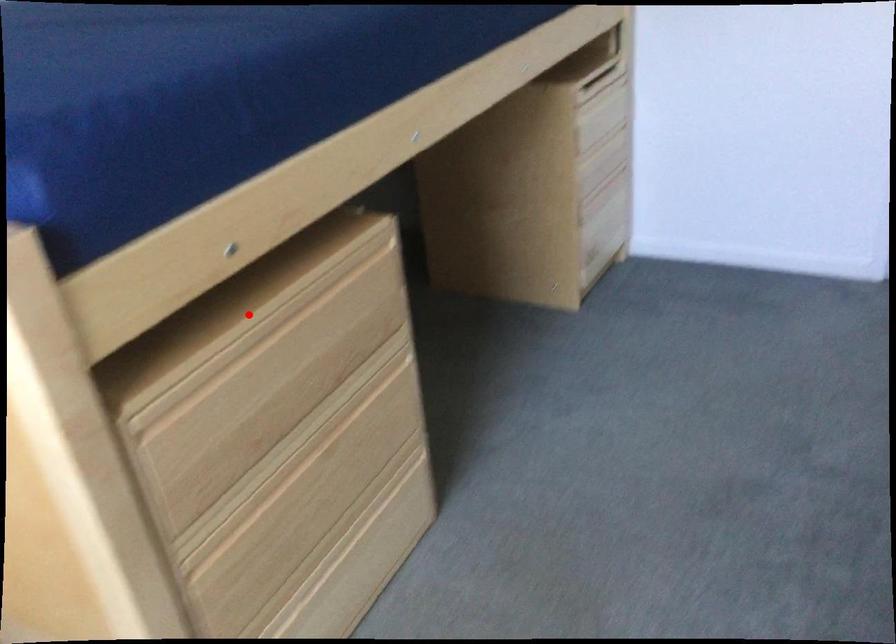
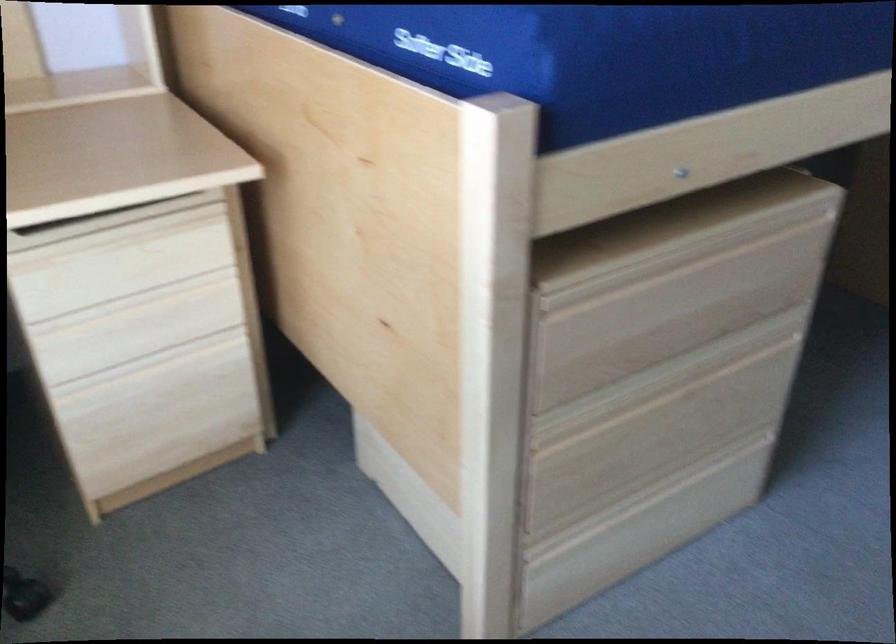
The point at the highlighted location is marked in the first image. Where is the corresponding point in the second image?

(668, 240)